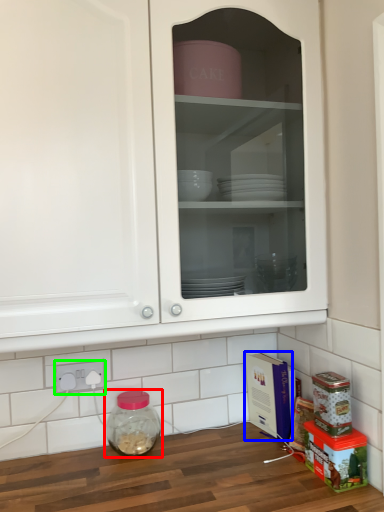
Question: Estimate the real-world distances between objects in this image. Which object is farther from glass jar (highlighted by a red box), cardboard box (highlighted by a blue box) or electric outlet (highlighted by a green box)?

Choices:
 (A) cardboard box
 (B) electric outlet

Answer: (A)